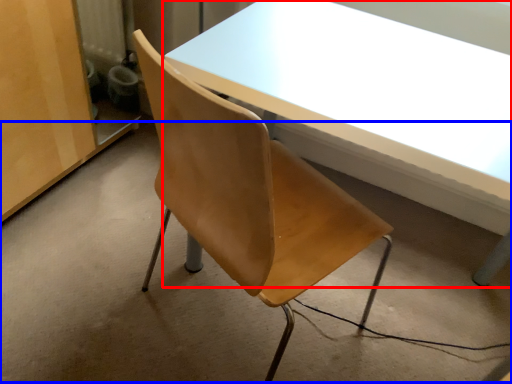
Question: Which object is further to the camera taking this photo, table (highlighted by a red box) or concrete (highlighted by a blue box)?

Choices:
 (A) table
 (B) concrete

Answer: (B)